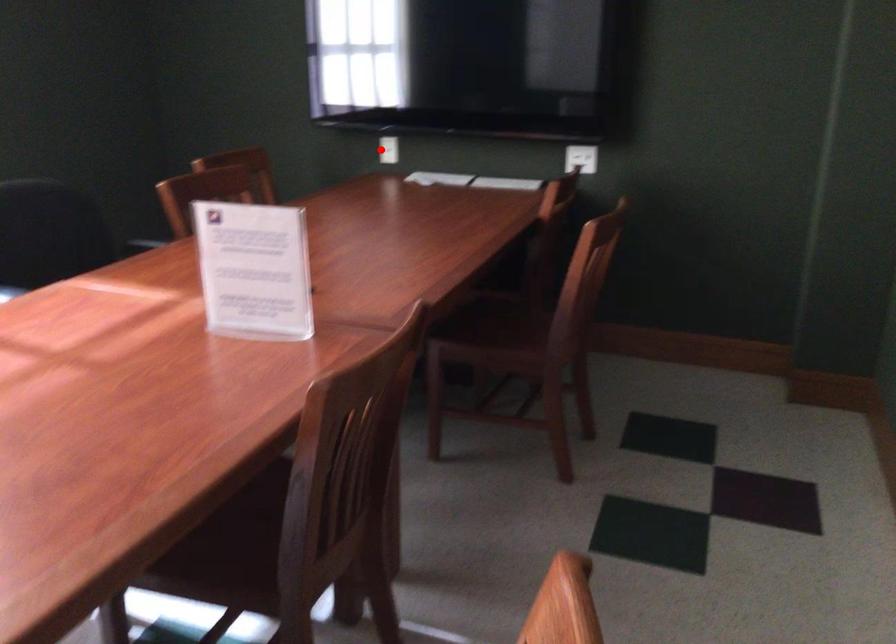
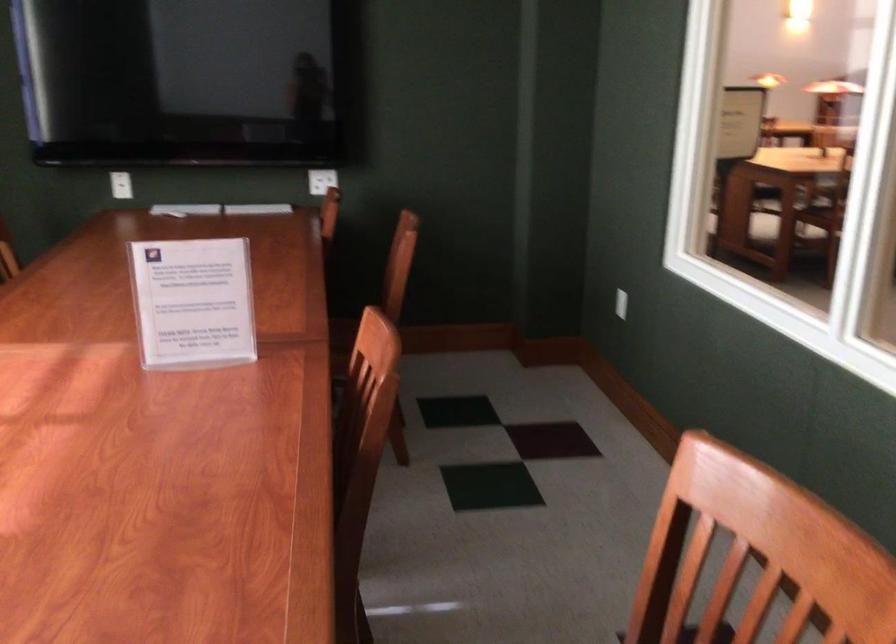
The point at the highlighted location is marked in the first image. Where is the corresponding point in the second image?

(121, 185)